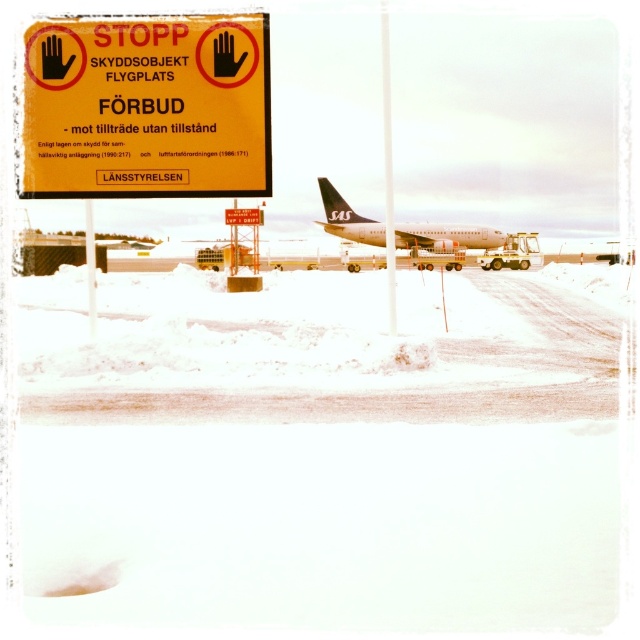
What is the spatial relationship between the white asphalt tarmac at center and the metallic pole at center in the snowy airport scene?

The white asphalt tarmac at center is closer to the viewer than the metallic pole at center.

What is the spatial relationship between the white asphalt tarmac at center and the yellow plastic sign at upper left in the snowy airport scene?

The white asphalt tarmac at center is positioned under the yellow plastic sign at upper left.

user is a drone operator planning to fly a drone over the snowy airport scene. The user wants to know if the point at coordinates point (320, 452) is on a prohibited area according to the sign.

The point (320, 452) is on white asphalt tarmac at center, which is prohibited access to airport facilities without permission according to the sign. Therefore, the user cannot fly the drone over that point without authorization.